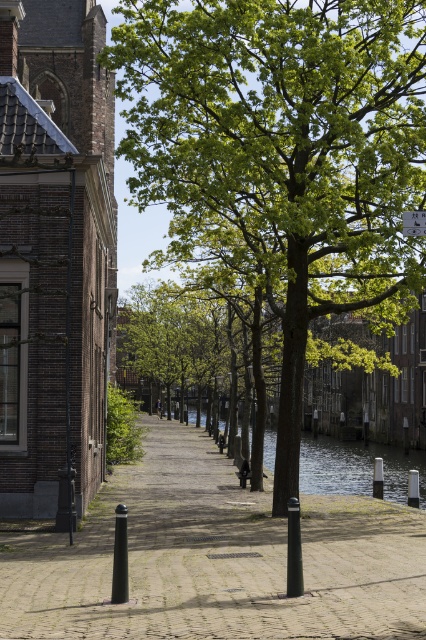
Does brick paved walkway at center appear over clear water at center?

Yes.

Which is more to the right, brick paved walkway at center or clear water at center?

From the viewer's perspective, clear water at center appears more on the right side.

Is point (279, 605) positioned before point (422, 451)?

That is True.

At what (x,y) coordinates should I click in order to perform the action: click on brick paved walkway at center. Please return your answer as a coordinate pair (x, y). Looking at the image, I should click on (215, 560).

Can you confirm if clear water at center is positioned to the left of white plastic sign at upper center?

In fact, clear water at center is to the right of white plastic sign at upper center.

Is clear water at center taller than white plastic sign at upper center?

Yes.

Which is behind, point (344, 476) or point (420, 212)?

Positioned behind is point (344, 476).

Where is `clear water at center`? Image resolution: width=426 pixels, height=640 pixels. clear water at center is located at coordinates (356, 467).

Does green leafy tree at center have a lesser height compared to white plastic sign at upper center?

No.

In the scene shown: Is green leafy tree at center taller than white plastic sign at upper center?

Yes.

Identify the location of green leafy tree at center. (281, 156).